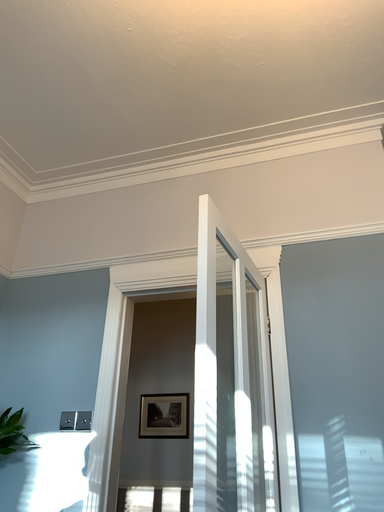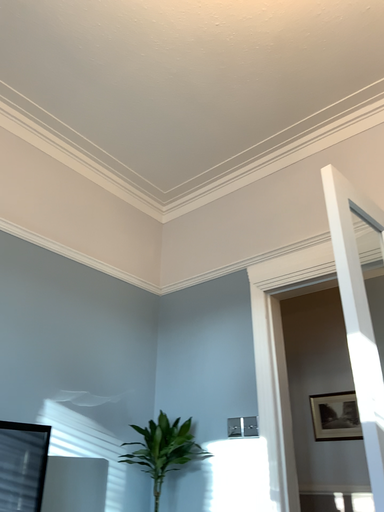
Question: How did the camera likely rotate when shooting the video?

Choices:
 (A) rotated right
 (B) rotated left

Answer: (B)